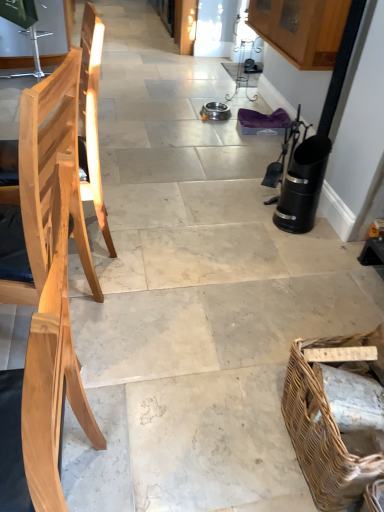
Question: From the image's perspective, is brown woven picnic basket at lower right on top of natural wood chair at left, the 1th chair when ordered from front to back?

Choices:
 (A) yes
 (B) no

Answer: (B)

Question: Could natural wood chair at left, the 1th chair when ordered from front to back, be considered to be inside brown woven picnic basket at lower right?

Choices:
 (A) yes
 (B) no

Answer: (B)

Question: Is there a large distance between brown woven picnic basket at lower right and natural wood chair at left, the second chair when ordered from back to front?

Choices:
 (A) no
 (B) yes

Answer: (A)

Question: Is brown woven picnic basket at lower right oriented towards natural wood chair at left, acting as the first chair starting from the bottom?

Choices:
 (A) yes
 (B) no

Answer: (A)

Question: From the image's perspective, is brown woven picnic basket at lower right beneath natural wood chair at left, the second chair when ordered from back to front?

Choices:
 (A) yes
 (B) no

Answer: (A)

Question: From a real-world perspective, is brown woven picnic basket at lower right positioned under natural wood chair at left, the second chair when ordered from back to front, based on gravity?

Choices:
 (A) yes
 (B) no

Answer: (A)

Question: Can brown woven picnic basket at lower right be found inside natural wood chair at left, acting as the first chair starting from the bottom?

Choices:
 (A) no
 (B) yes

Answer: (A)

Question: From a real-world perspective, is natural wood chair at left, acting as the first chair starting from the bottom, located higher than brown woven picnic basket at lower right?

Choices:
 (A) yes
 (B) no

Answer: (A)

Question: Is natural wood chair at left, the second chair when ordered from back to front, touching brown woven picnic basket at lower right?

Choices:
 (A) no
 (B) yes

Answer: (A)

Question: Considering the relative sizes of natural wood chair at left, the second chair when ordered from back to front, and brown woven picnic basket at lower right in the image provided, is natural wood chair at left, the second chair when ordered from back to front, smaller than brown woven picnic basket at lower right?

Choices:
 (A) no
 (B) yes

Answer: (A)

Question: From a real-world perspective, is natural wood chair at left, acting as the first chair starting from the bottom, below brown woven picnic basket at lower right?

Choices:
 (A) yes
 (B) no

Answer: (B)

Question: From the image's perspective, would you say natural wood chair at left, the second chair when ordered from back to front, is shown under brown woven picnic basket at lower right?

Choices:
 (A) yes
 (B) no

Answer: (B)

Question: Is natural wood chair at left, which ranks as the second chair in front-to-back order, facing away from natural wood chair at left, the second chair when ordered from back to front?

Choices:
 (A) yes
 (B) no

Answer: (B)